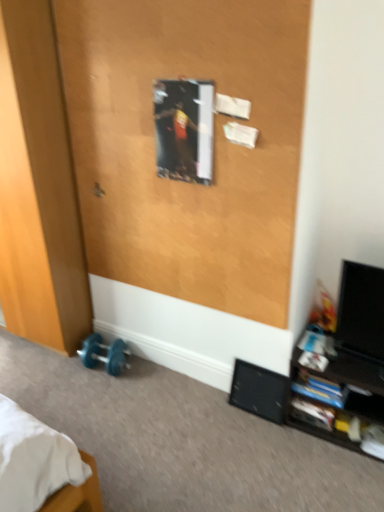
Where is `vacant space in wooden poster at upper center, which is counted as the 1th screen door, starting from the right (from a real-world perspective)`? Image resolution: width=384 pixels, height=512 pixels. vacant space in wooden poster at upper center, which is counted as the 1th screen door, starting from the right (from a real-world perspective) is located at coordinates (194, 378).